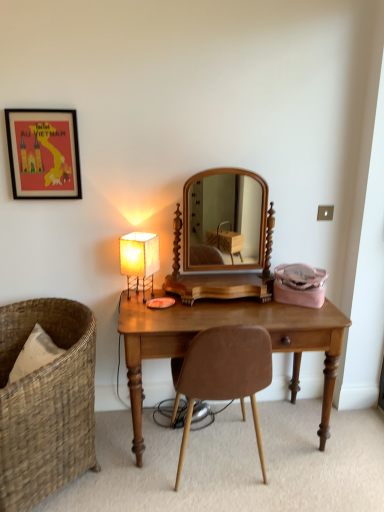
Question: Is white paper lampshade at left facing away from brown leather chair at center, which is the second chair in left-to-right order?

Choices:
 (A) no
 (B) yes

Answer: (A)

Question: From the image's perspective, does white paper lampshade at left appear lower than brown leather chair at center, which ranks as the 1th chair in right-to-left order?

Choices:
 (A) no
 (B) yes

Answer: (A)

Question: Does white paper lampshade at left appear on the right side of brown leather chair at center, which is the second chair in left-to-right order?

Choices:
 (A) yes
 (B) no

Answer: (B)

Question: Does white paper lampshade at left have a lesser height compared to brown leather chair at center, which is the second chair in left-to-right order?

Choices:
 (A) yes
 (B) no

Answer: (A)

Question: Is white paper lampshade at left outside of brown leather chair at center, which is the second chair in left-to-right order?

Choices:
 (A) yes
 (B) no

Answer: (A)

Question: Does white paper lampshade at left appear on the left side of brown leather chair at center, which is the second chair in left-to-right order?

Choices:
 (A) yes
 (B) no

Answer: (A)

Question: Is wooden desk at center far from brown leather chair at center, which ranks as the 1th chair in right-to-left order?

Choices:
 (A) yes
 (B) no

Answer: (B)

Question: Considering the relative sizes of wooden desk at center and brown leather chair at center, which ranks as the 1th chair in right-to-left order, in the image provided, is wooden desk at center taller than brown leather chair at center, which ranks as the 1th chair in right-to-left order,?

Choices:
 (A) yes
 (B) no

Answer: (B)

Question: Are wooden desk at center and brown leather chair at center, which is the second chair in left-to-right order, beside each other?

Choices:
 (A) yes
 (B) no

Answer: (B)

Question: Is the depth of wooden desk at center greater than that of brown leather chair at center, which ranks as the 1th chair in right-to-left order?

Choices:
 (A) yes
 (B) no

Answer: (A)

Question: From a real-world perspective, is wooden desk at center on brown leather chair at center, which ranks as the 1th chair in right-to-left order?

Choices:
 (A) yes
 (B) no

Answer: (B)

Question: Considering the relative positions of wooden desk at center and brown leather chair at center, which ranks as the 1th chair in right-to-left order, in the image provided, is wooden desk at center to the left of brown leather chair at center, which ranks as the 1th chair in right-to-left order, from the viewer's perspective?

Choices:
 (A) yes
 (B) no

Answer: (B)

Question: Can you confirm if woven brown chair at left, the 2th chair in the right-to-left sequence, is smaller than wooden desk at center?

Choices:
 (A) yes
 (B) no

Answer: (A)